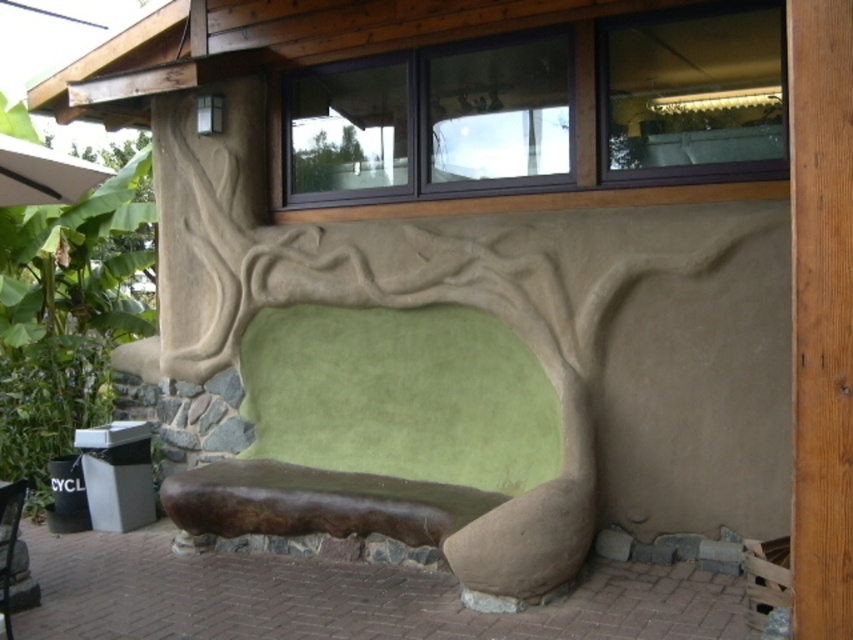
Question: Is brown wood at center below green leafy tree at lower left?

Choices:
 (A) yes
 (B) no

Answer: (A)

Question: Does brown wood at center appear under green leafy tree at lower left?

Choices:
 (A) yes
 (B) no

Answer: (A)

Question: Which of the following is the closest to the observer?

Choices:
 (A) green leafy tree at lower left
 (B) brown wood at center

Answer: (B)

Question: Is brown wood at center to the left of green leafy tree at lower left from the viewer's perspective?

Choices:
 (A) yes
 (B) no

Answer: (B)

Question: Which object appears closest to the camera in this image?

Choices:
 (A) green leafy tree at lower left
 (B) brown wood at center

Answer: (B)